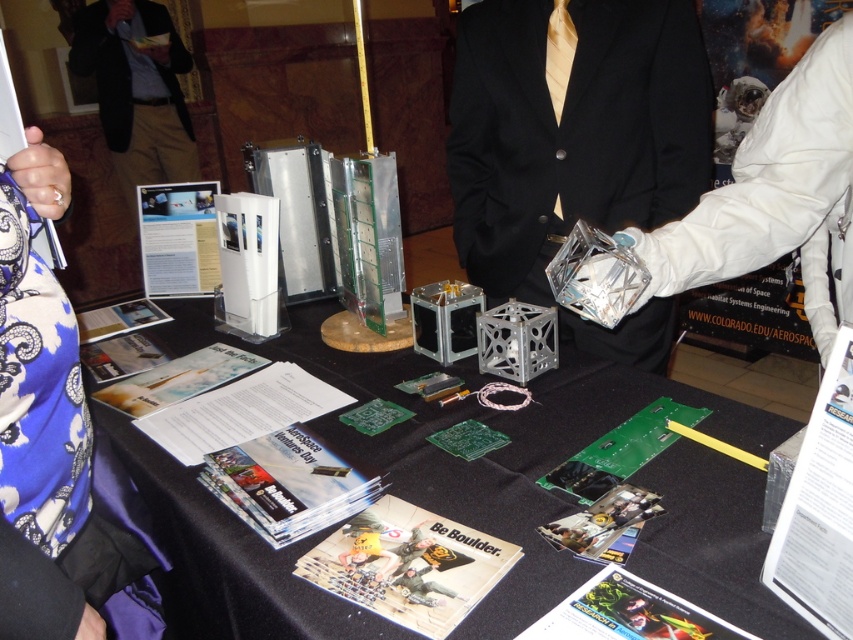
Between black matte suit at center and white paper at upper left, which one is positioned higher?

Positioned higher is black matte suit at center.

Describe the element at coordinates (572, 129) in the screenshot. I see `black matte suit at center` at that location.

Locate an element on the screen. The image size is (853, 640). black matte suit at center is located at coordinates (572, 129).

Can you confirm if white paper at center is positioned above white paper at upper left?

Incorrect, white paper at center is not positioned above white paper at upper left.

Between white paper at center and white paper at upper left, which one has less height?

Standing shorter between the two is white paper at upper left.

This screenshot has width=853, height=640. Describe the element at coordinates (819, 508) in the screenshot. I see `white paper at center` at that location.

In order to click on white paper at center in this screenshot , I will do `click(819, 508)`.

Which is more to the right, green circuit board at center or white paper at center?

Positioned to the right is white paper at center.

Does green circuit board at center have a lesser height compared to white paper at center?

Incorrect, green circuit board at center's height does not fall short of white paper at center's.

Locate an element on the screen. green circuit board at center is located at coordinates (486, 452).

Where is `green circuit board at center`? The height and width of the screenshot is (640, 853). green circuit board at center is located at coordinates (486, 452).